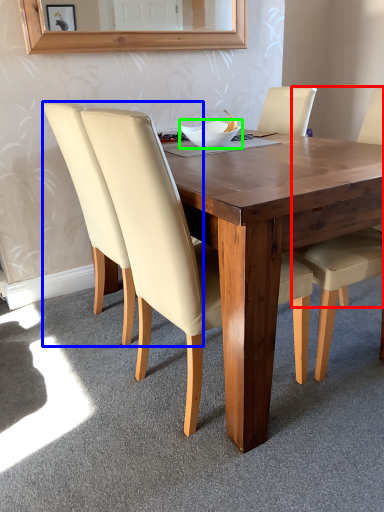
Question: Based on their relative distances, which object is farther from chair (highlighted by a red box)? Choose from chair (highlighted by a blue box) and bowl (highlighted by a green box).

Choices:
 (A) chair
 (B) bowl

Answer: (A)